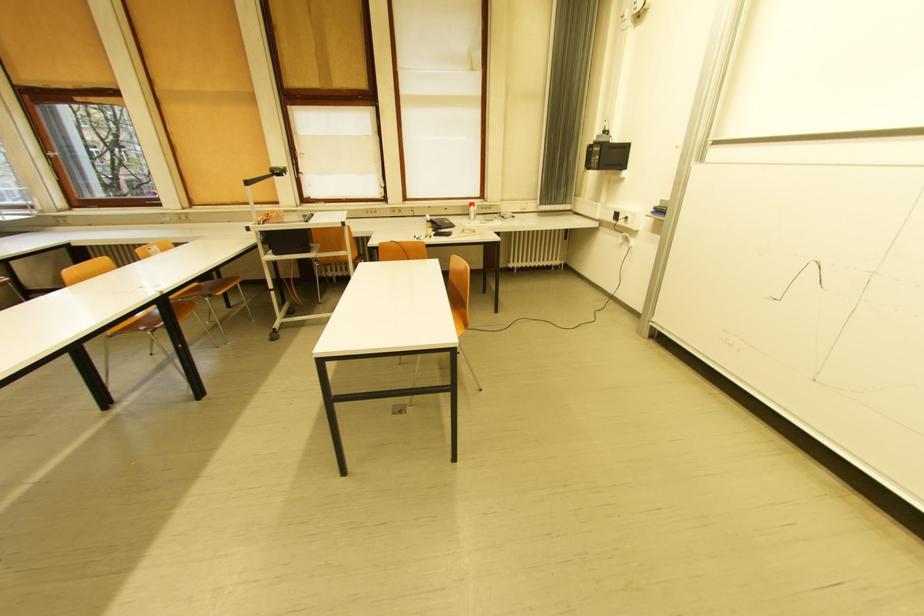
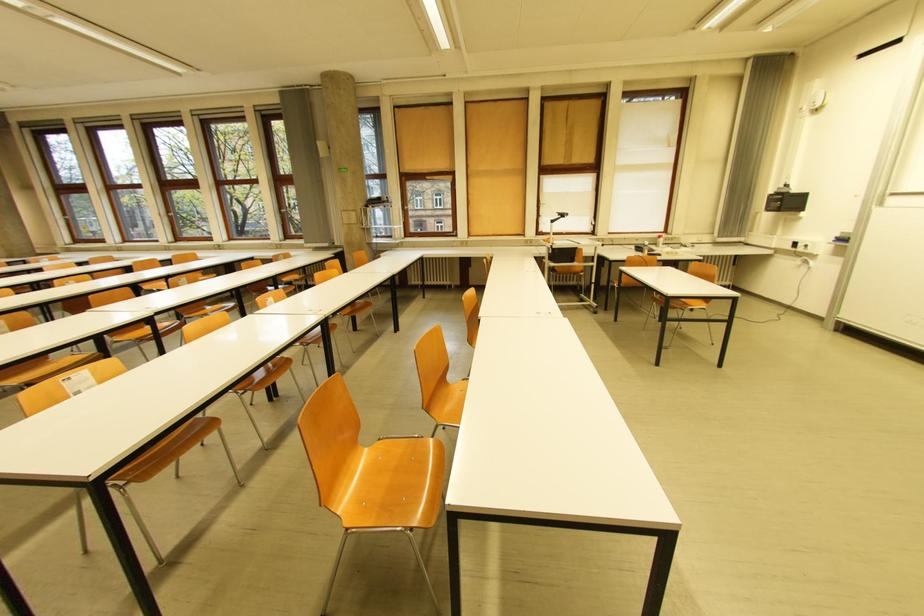
The point at (x=479, y=71) is marked in the first image. Where is the corresponding point in the second image?

(676, 148)